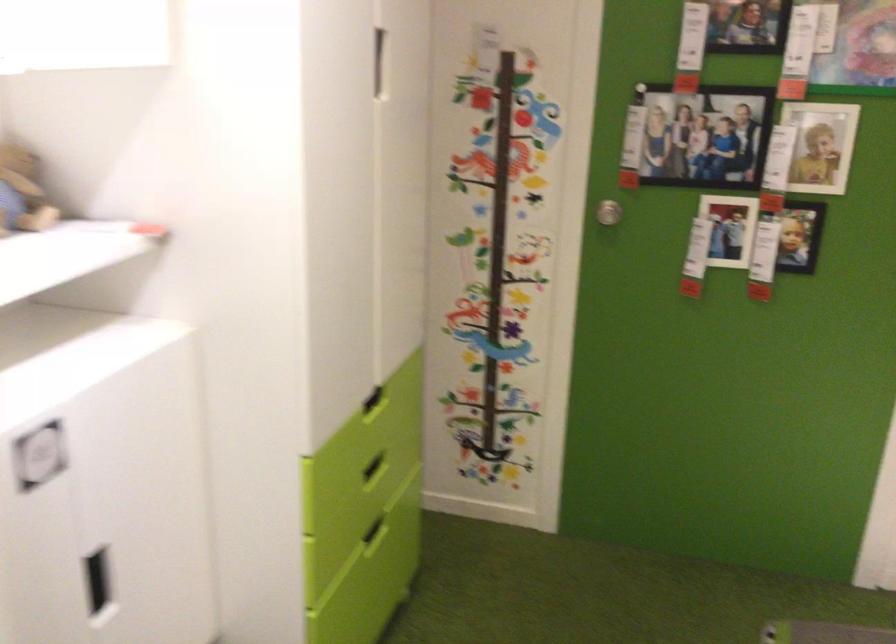
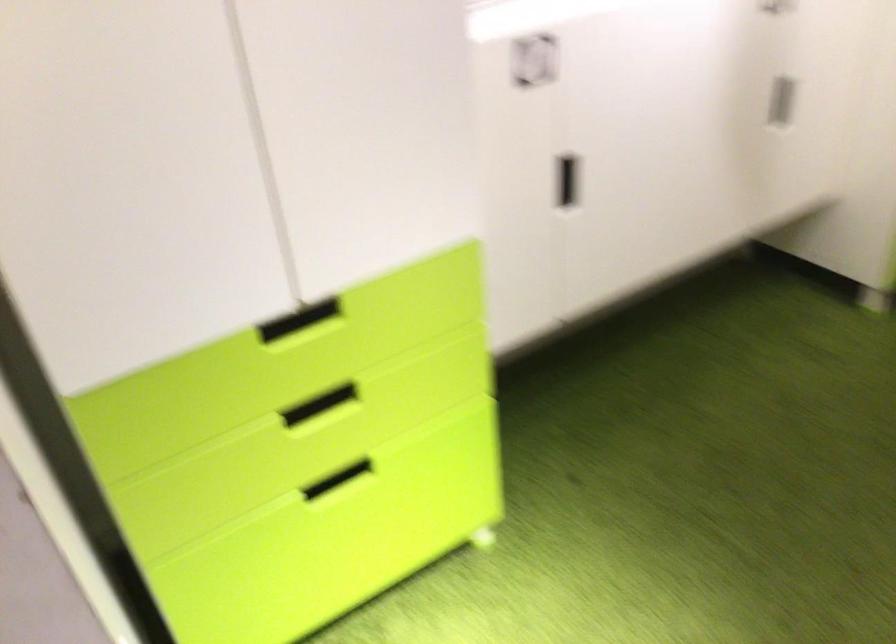
How did the camera likely rotate?

The rotation direction of the camera is left-down.